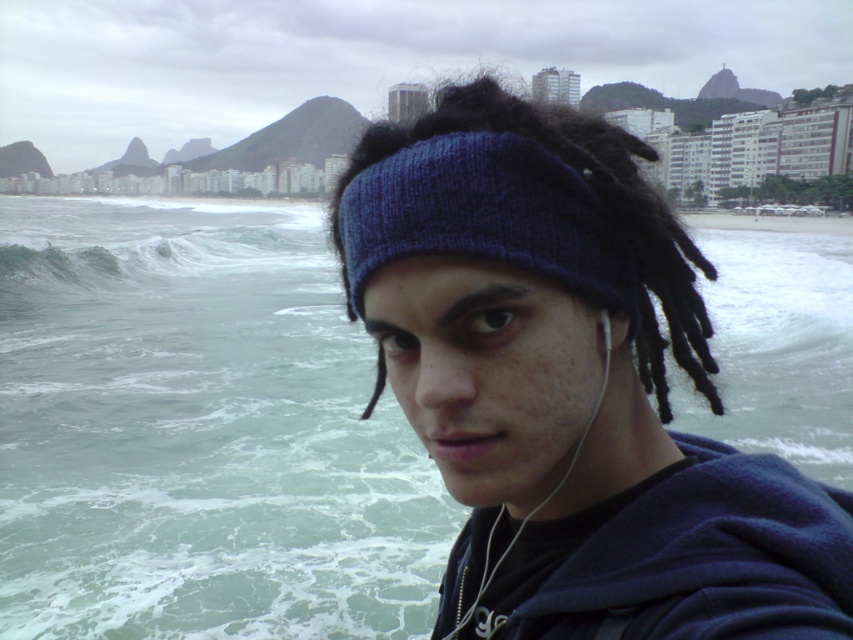
Question: Which of the following is the farthest from the observer?

Choices:
 (A) green frothy wave at left
 (B) greenish water at lower left

Answer: (A)

Question: Among these objects, which one is farthest from the camera?

Choices:
 (A) green frothy wave at left
 (B) greenish water at lower left

Answer: (A)

Question: In this image, where is greenish water at lower left located relative to green frothy wave at left?

Choices:
 (A) below
 (B) above

Answer: (A)

Question: Among these points, which one is farthest from the camera?

Choices:
 (A) (32, 225)
 (B) (838, 294)

Answer: (A)

Question: Is greenish water at lower left thinner than green frothy wave at left?

Choices:
 (A) no
 (B) yes

Answer: (A)

Question: Is the position of greenish water at lower left more distant than that of green frothy wave at left?

Choices:
 (A) yes
 (B) no

Answer: (B)